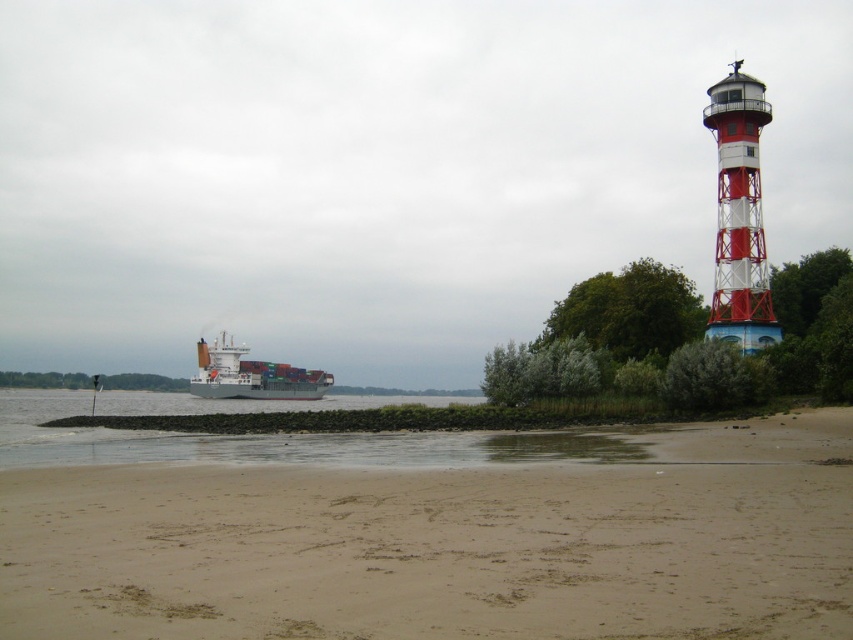
Is sandy at lower center smaller than red and white striped lighthouse at upper right?

Yes, sandy at lower center is smaller than red and white striped lighthouse at upper right.

Does sandy at lower center have a greater width compared to red and white striped lighthouse at upper right?

Yes.

This screenshot has height=640, width=853. What do you see at coordinates (445, 545) in the screenshot?
I see `sandy at lower center` at bounding box center [445, 545].

Identify the location of sandy at lower center. The image size is (853, 640). (445, 545).

Is point (471, 561) positioned before point (242, 392)?

Yes, point (471, 561) is in front of point (242, 392).

Is sandy at lower center shorter than gray matte container ship at left?

Correct, sandy at lower center is not as tall as gray matte container ship at left.

At what (x,y) coordinates should I click in order to perform the action: click on sandy at lower center. Please return your answer as a coordinate pair (x, y). The width and height of the screenshot is (853, 640). Looking at the image, I should click on (445, 545).

Does red and white striped lighthouse at upper right have a lesser width compared to gray matte container ship at left?

Yes.

Can you confirm if red and white striped lighthouse at upper right is smaller than gray matte container ship at left?

Indeed, red and white striped lighthouse at upper right has a smaller size compared to gray matte container ship at left.

Is point (740, 253) positioned before point (224, 340)?

Yes, point (740, 253) is in front of point (224, 340).

Find the location of `red and white striped lighthouse at upper right`. red and white striped lighthouse at upper right is located at coordinates (740, 216).